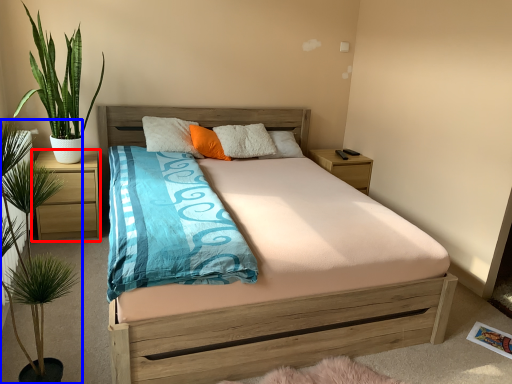
Question: Which object appears closest to the camera in this image, nightstand (highlighted by a red box) or houseplant (highlighted by a blue box)?

Choices:
 (A) nightstand
 (B) houseplant

Answer: (B)